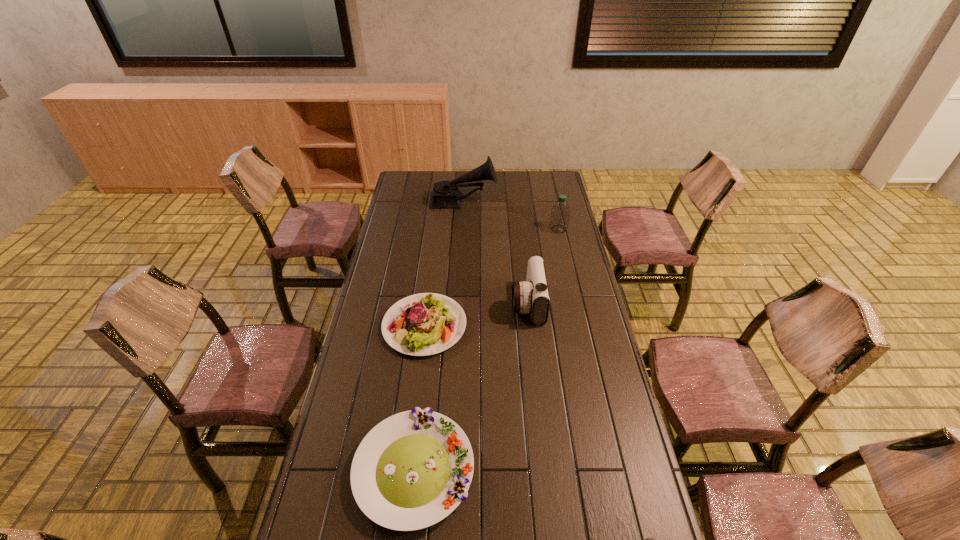
Identify the location of the fourth closest object to the farthest object. (413, 469).

I want to click on free space that satisfies the following two spatial constraints: 1. on the surface of the camcorder; 2. on the front side of the fifth tallest object, so click(546, 470).

The image size is (960, 540). Identify the location of vacant area that satisfies the following two spatial constraints: 1. from the horn of the water bottle; 2. on the left side of the farthest object. (462, 229).